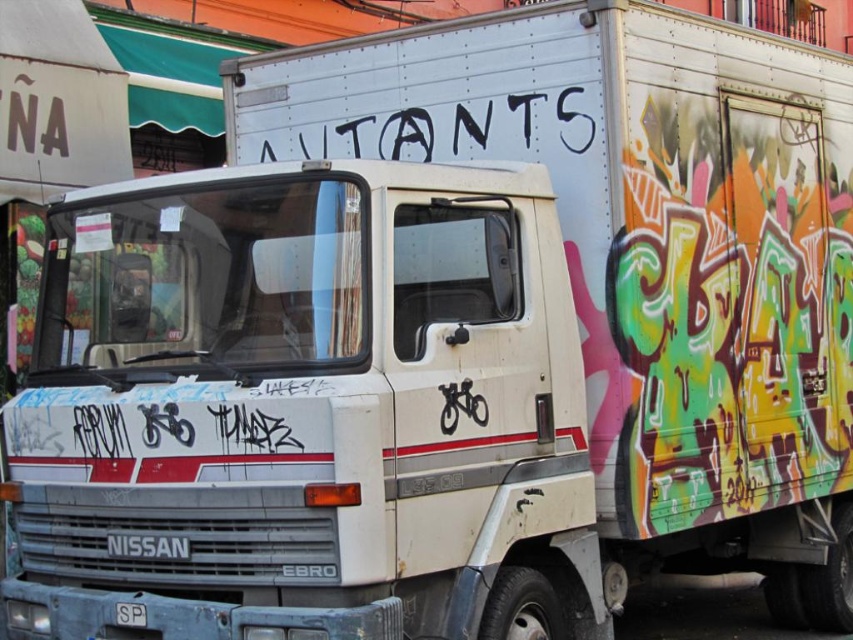
The image size is (853, 640). What do you see at coordinates (444, 128) in the screenshot?
I see `black paint graffiti at upper center` at bounding box center [444, 128].

Is black paint graffiti at upper center further to the viewer compared to white plastic license plate at center?

Yes, it is.

Identify the location of black paint graffiti at upper center. This screenshot has height=640, width=853. (444, 128).

You are a GUI agent. You are given a task and a screenshot of the screen. Output one action in this format:
    pyautogui.click(x=<x>, y=<y>)
    Task: Click on the black paint graffiti at upper center
    This screenshot has height=640, width=853.
    Given the screenshot: What is the action you would take?
    pyautogui.click(x=444, y=128)